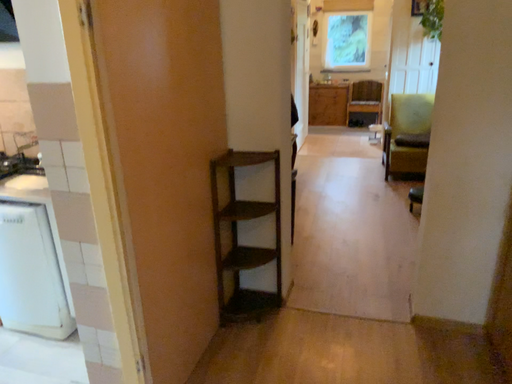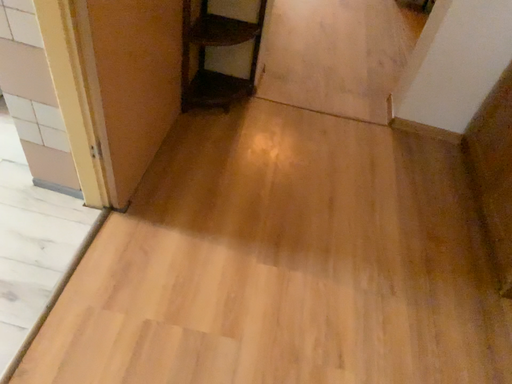
Question: Which way did the camera rotate in the video?

Choices:
 (A) rotated left
 (B) rotated right

Answer: (B)